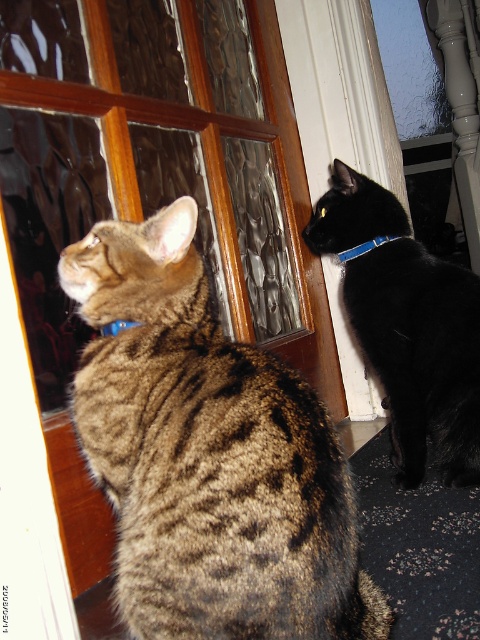
You are a cat owner trying to determine which of your cats is closer to the door. You have two cats in the image, one at point (459, 385) and the other at point (346, 257). Based on their positions, which cat is closer to the door?

Point (459, 385) is in front of point (346, 257), so the cat at point (459, 385) is closer to the door.

You are standing in the room and see two points on the glass door. The first point is at coordinates point (190, 385) and the second is at point (135, 324). Which point is nearer to you?

Point (190, 385) is closer to the viewer than point (135, 324).